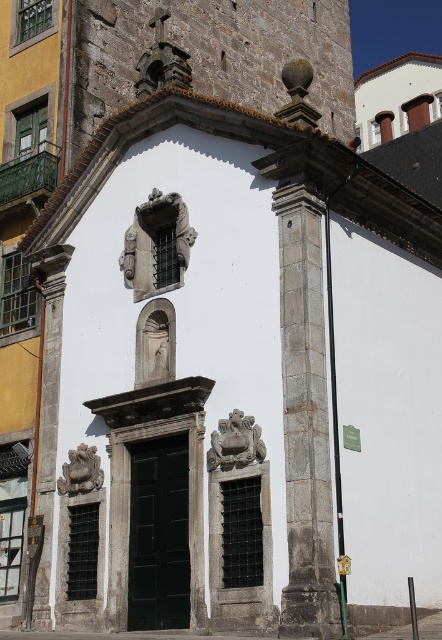
You are standing in front of the historic building and want to locate the smooth stone column at left. Based on the coordinates provided, where should you look relative to the entrance?

The smooth stone column at left is located at coordinates point (48, 364), which means it is positioned to the left side of the entrance.

You are an architect examining the building facade. You notice the gray stone column at center and the smooth stone column at left. Which column is larger in size?

The smooth stone column at left is larger than the gray stone column at center.